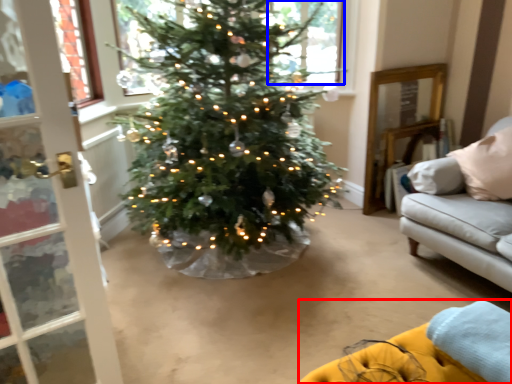
Question: Among these objects, which one is farthest to the camera, couch (highlighted by a red box) or window (highlighted by a blue box)?

Choices:
 (A) couch
 (B) window

Answer: (B)